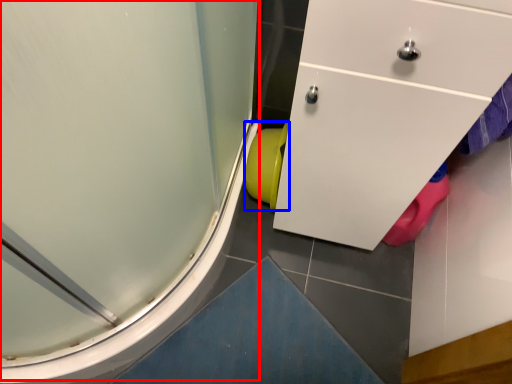
Question: Which object appears closest to the camera in this image, shower door (highlighted by a red box) or toilet bowl (highlighted by a blue box)?

Choices:
 (A) shower door
 (B) toilet bowl

Answer: (A)